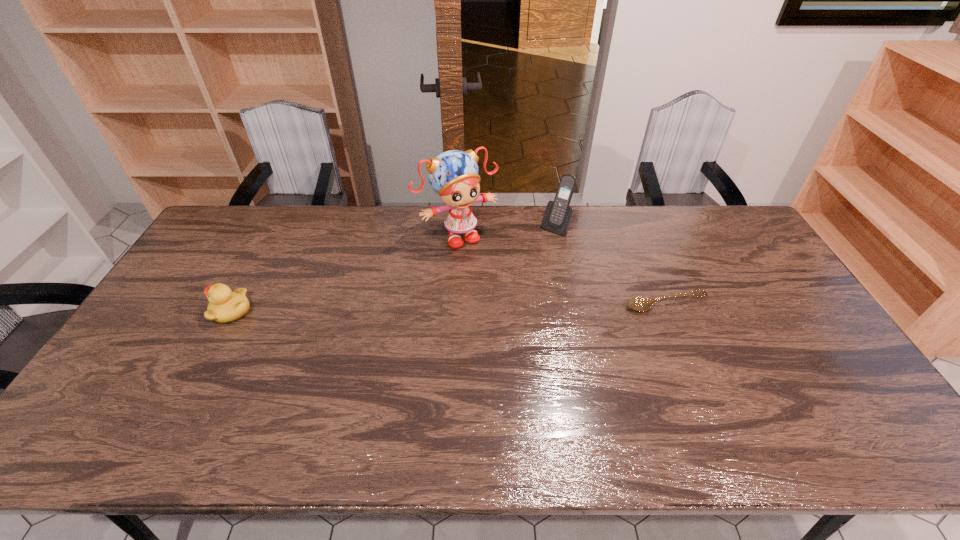
You are a GUI agent. You are given a task and a screenshot of the screen. Output one action in this format:
    pyautogui.click(x=<x>, y=<y>)
    Task: Click on the vacant space on the desktop that is between the leftmost object and the shortest object and is positioned on the face of the tallest object
    The height and width of the screenshot is (540, 960).
    Given the screenshot: What is the action you would take?
    pyautogui.click(x=506, y=306)

Where is `free space on the desktop that is between the leftmost object and the shortest object and is positioned on the front-facing side of the second tallest object`? The image size is (960, 540). free space on the desktop that is between the leftmost object and the shortest object and is positioned on the front-facing side of the second tallest object is located at coordinates (490, 307).